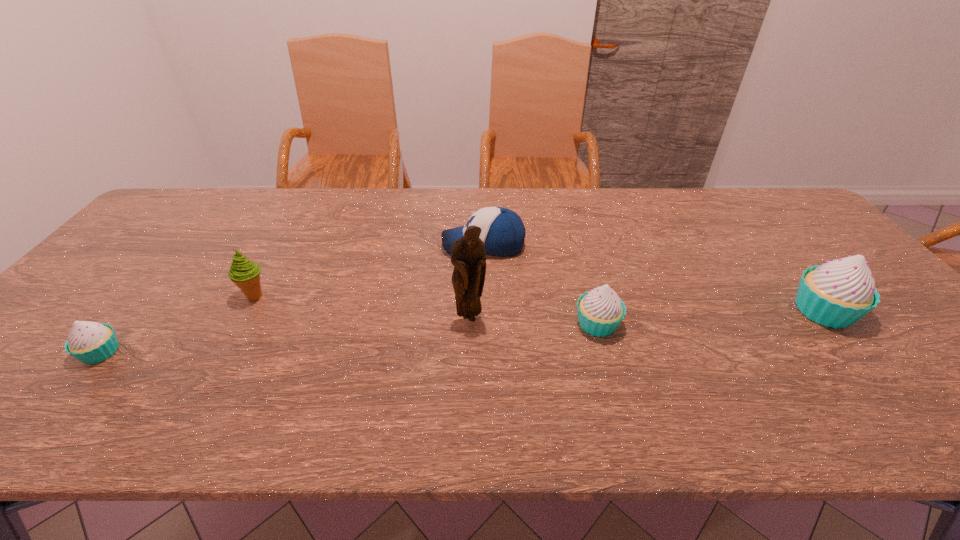
Where is `vacant space located on the back of the second cupcake from left to right`? The image size is (960, 540). vacant space located on the back of the second cupcake from left to right is located at coordinates (575, 241).

Find the location of `blank space located 0.280m on the left of the rightmost object`. blank space located 0.280m on the left of the rightmost object is located at coordinates (680, 311).

In order to click on free point located on the right of the icecream in this screenshot , I will do `click(378, 296)`.

At what (x,y) coordinates should I click in order to perform the action: click on vacant space located on the front-facing side of the baseball cap. Please return your answer as a coordinate pair (x, y). This screenshot has height=540, width=960. Looking at the image, I should click on (355, 245).

In order to click on vacant space located on the front-facing side of the baseball cap in this screenshot , I will do `click(382, 245)`.

At what (x,y) coordinates should I click in order to perform the action: click on blank space located on the front-facing side of the baseball cap. Please return your answer as a coordinate pair (x, y). The width and height of the screenshot is (960, 540). Looking at the image, I should click on (355, 245).

The width and height of the screenshot is (960, 540). In order to click on vacant space located on the front-facing side of the figurine in this screenshot , I will do `click(468, 382)`.

Where is `object that is at the near edge`? This screenshot has height=540, width=960. object that is at the near edge is located at coordinates (90, 342).

This screenshot has height=540, width=960. I want to click on object that is at the left edge, so click(x=90, y=342).

This screenshot has width=960, height=540. Identify the location of object that is at the right edge. (837, 294).